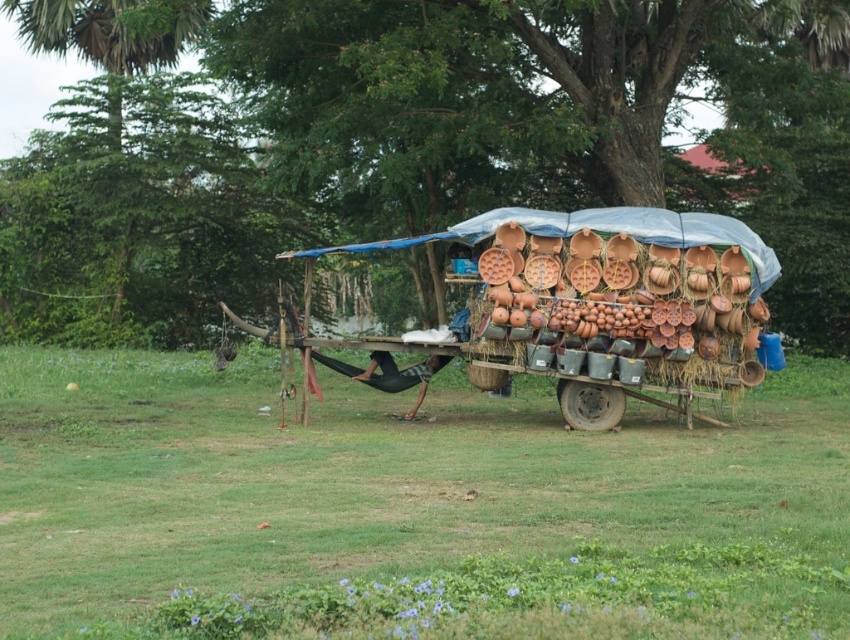
Who is higher up, green grass at lower center or terracotta clay cart at center?

terracotta clay cart at center is higher up.

Can you confirm if green grass at lower center is taller than terracotta clay cart at center?

In fact, green grass at lower center may be shorter than terracotta clay cart at center.

What do you see at coordinates (408, 508) in the screenshot? The height and width of the screenshot is (640, 850). I see `green grass at lower center` at bounding box center [408, 508].

Identify the location of green grass at lower center. (408, 508).